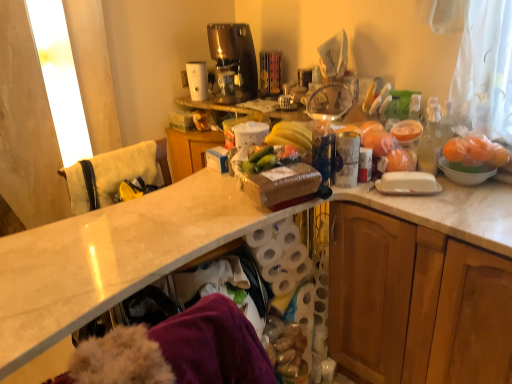
Image resolution: width=512 pixels, height=384 pixels. I want to click on vacant region in front of white glossy mixing bowl at right, so click(x=473, y=206).